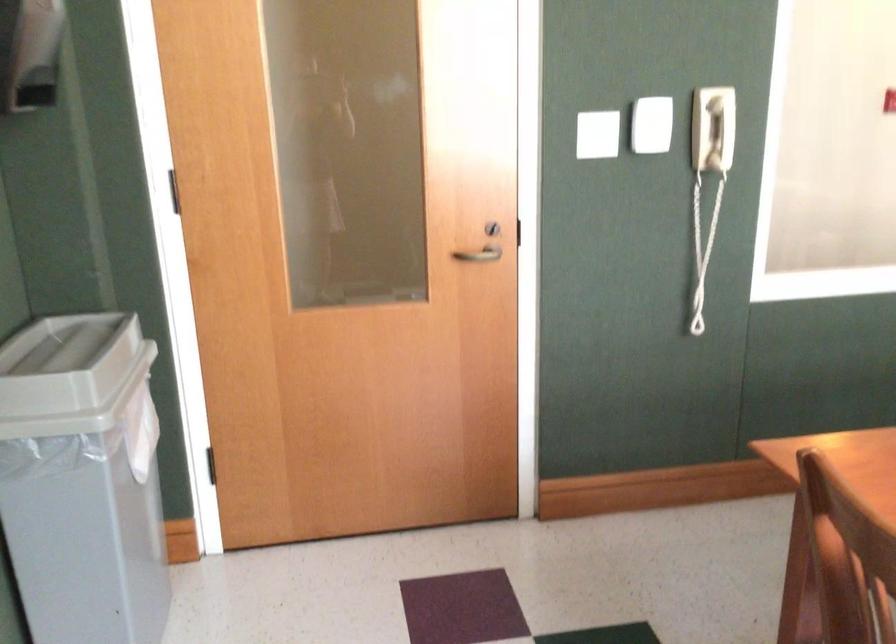
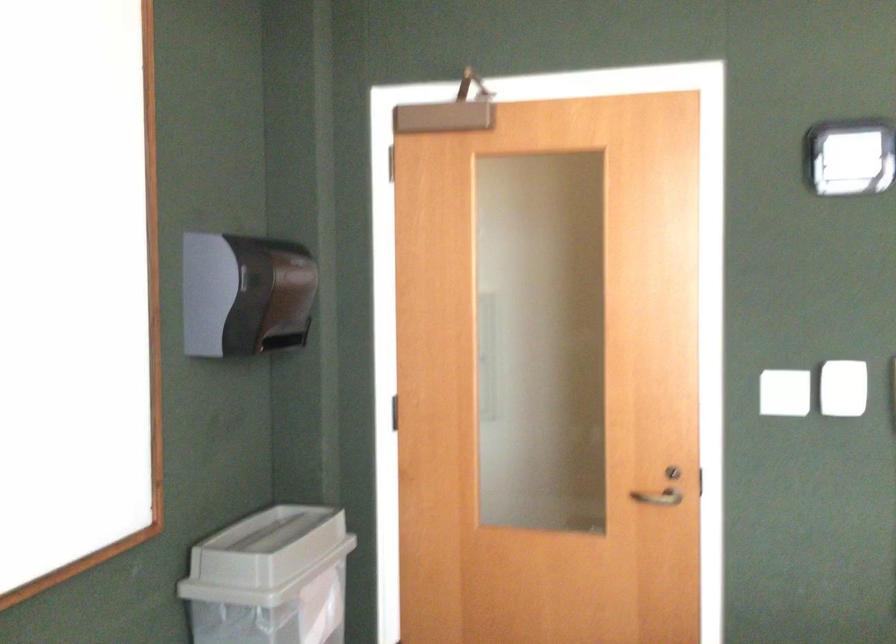
Question: The camera is either moving clockwise (left) or counter-clockwise (right) around the object. The first image is from the beginning of the video and the second image is from the end. Is the camera moving left or right when shooting the video?

Choices:
 (A) Left
 (B) Right

Answer: (B)